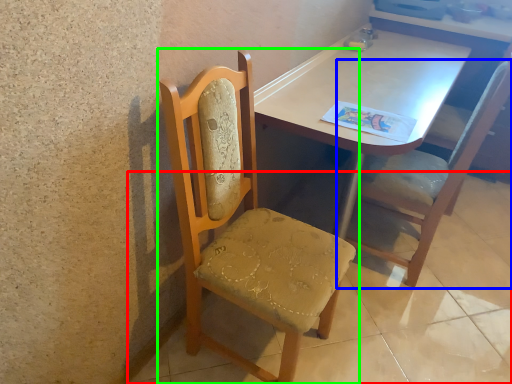
Question: Estimate the real-world distances between objects in this image. Which object is farther from concrete (highlighted by a red box), chair (highlighted by a blue box) or chair (highlighted by a green box)?

Choices:
 (A) chair
 (B) chair

Answer: (B)